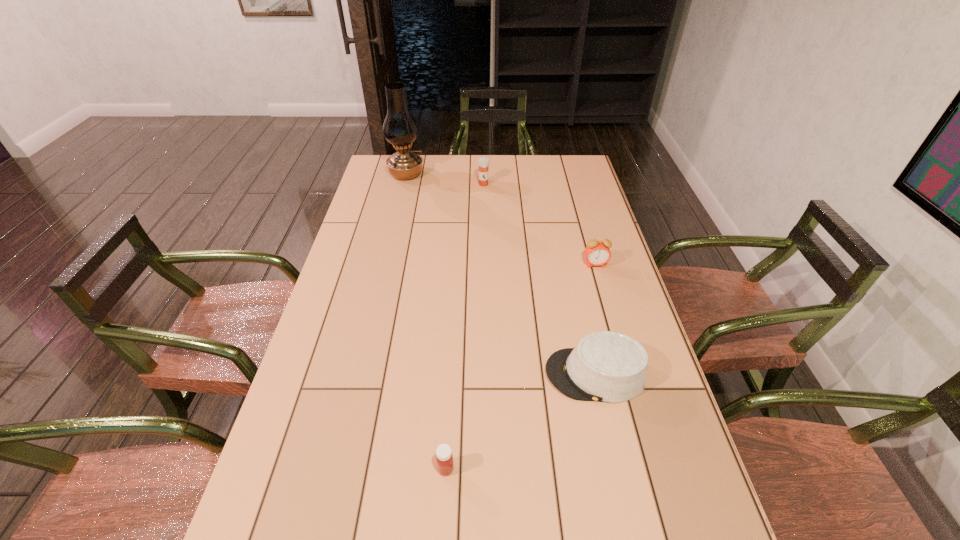
The height and width of the screenshot is (540, 960). Find the location of `the leftmost object`. the leftmost object is located at coordinates (400, 129).

What are the coordinates of `oil lamp` in the screenshot? It's located at (400, 129).

The width and height of the screenshot is (960, 540). I want to click on alarm clock, so click(597, 253).

Identify the location of the farther medicine. (483, 162).

The image size is (960, 540). What are the coordinates of `the taller medicine` in the screenshot? It's located at (x=483, y=162).

At what (x,y) coordinates should I click in order to perform the action: click on hat. Please return your answer as a coordinate pair (x, y). This screenshot has width=960, height=540. Looking at the image, I should click on (605, 366).

This screenshot has width=960, height=540. In order to click on the nearer medicine in this screenshot , I will do `click(444, 458)`.

Identify the location of the left medicine. The width and height of the screenshot is (960, 540). tap(444, 458).

The height and width of the screenshot is (540, 960). Identify the location of vacant position located 0.100m on the front of the tallest object. (400, 198).

I want to click on blank area located 0.170m on the face of the alarm clock, so click(x=608, y=308).